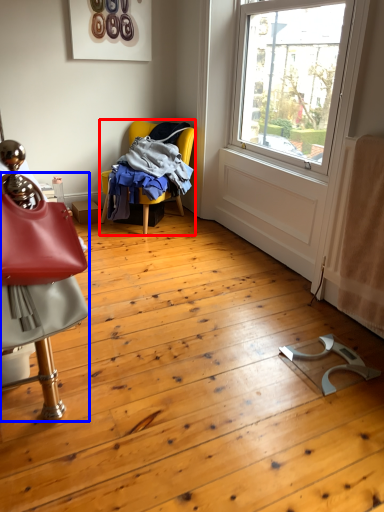
Question: Which of the following is the farthest to the observer, chair (highlighted by a red box) or chair (highlighted by a blue box)?

Choices:
 (A) chair
 (B) chair

Answer: (A)